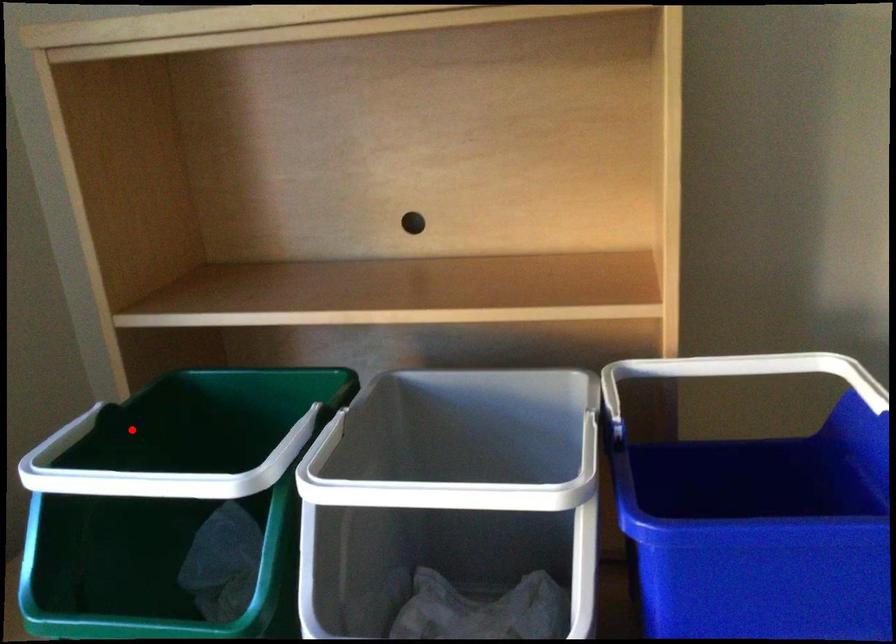
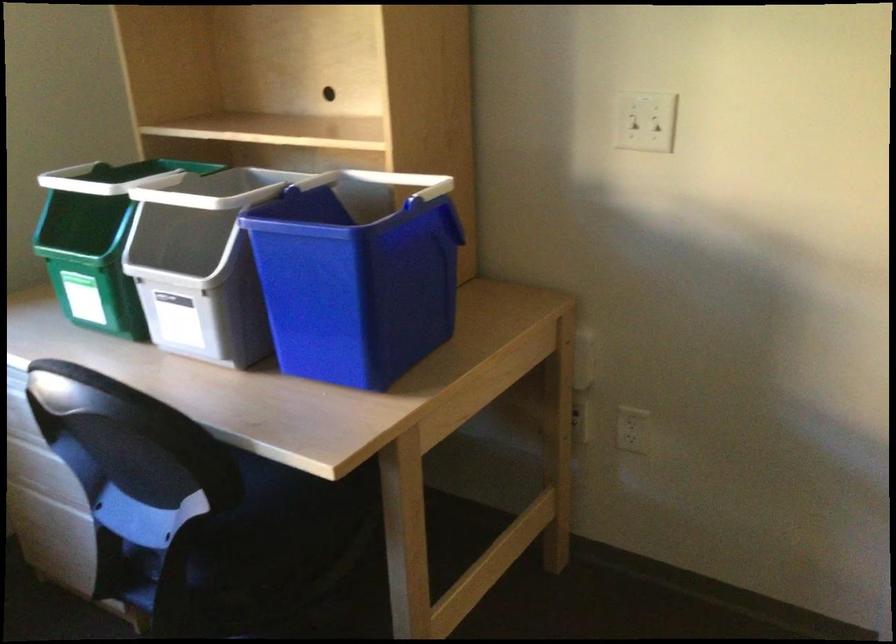
In the second image, find the point that corresponds to the highlighted location in the first image.

(116, 178)